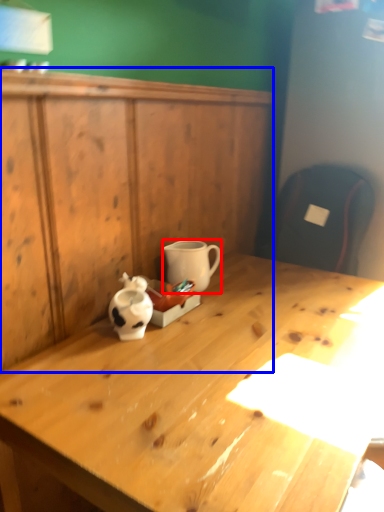
Question: Which object is further to the camera taking this photo, coffee cup (highlighted by a red box) or dresser (highlighted by a blue box)?

Choices:
 (A) coffee cup
 (B) dresser

Answer: (A)